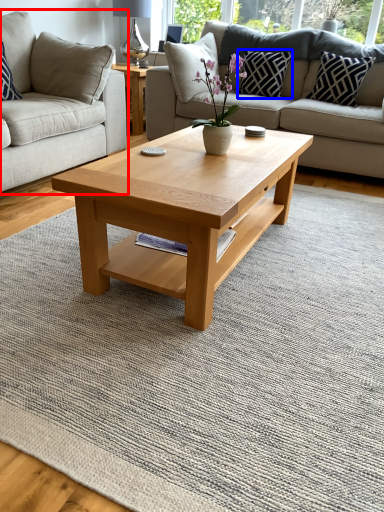
Question: Among these objects, which one is farthest to the camera, studio couch (highlighted by a red box) or pillow (highlighted by a blue box)?

Choices:
 (A) studio couch
 (B) pillow

Answer: (B)